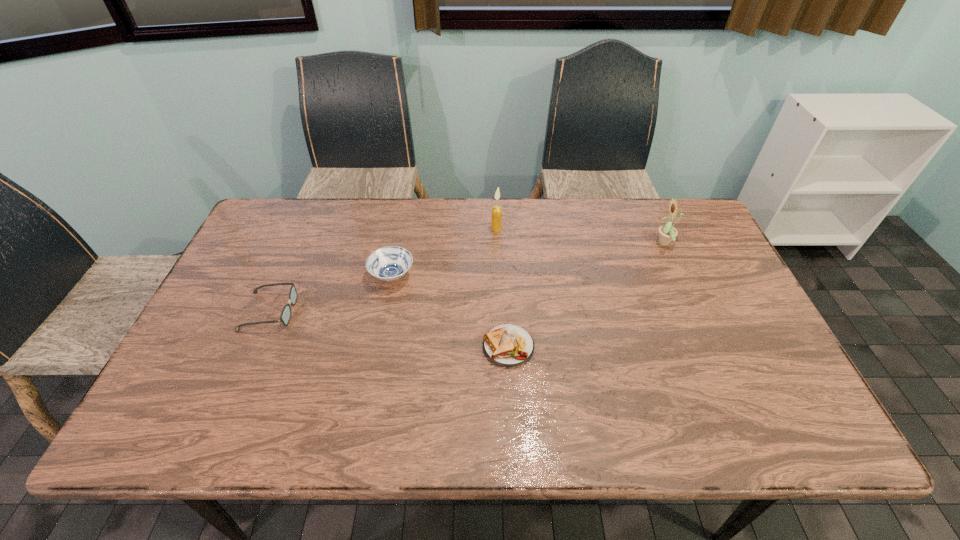
Locate an element on the screen. blank area located on the front-facing side of the fourth nearest object is located at coordinates (553, 244).

You are a GUI agent. You are given a task and a screenshot of the screen. Output one action in this format:
    pyautogui.click(x=<x>, y=<y>)
    Task: Click on the vacant space located on the front-facing side of the fourth nearest object
    The width and height of the screenshot is (960, 540).
    Given the screenshot: What is the action you would take?
    point(614,244)

At what (x,y) coordinates should I click in order to perform the action: click on free spot located on the left of the second object from left to right. Please return your answer as a coordinate pair (x, y). Looking at the image, I should click on (235, 276).

This screenshot has height=540, width=960. Identify the location of free space located 0.350m on the face of the second shortest object. (425, 311).

Where is `vacant space located 0.270m on the left of the shortest object`? Image resolution: width=960 pixels, height=540 pixels. vacant space located 0.270m on the left of the shortest object is located at coordinates (375, 346).

Find the location of a particular element. The image size is (960, 540). candle that is at the far edge is located at coordinates (496, 225).

The width and height of the screenshot is (960, 540). I want to click on sunflower located at the far edge, so click(x=667, y=233).

At what (x,y) coordinates should I click in order to perform the action: click on object positioned at the left edge. Please return your answer as a coordinate pair (x, y). This screenshot has width=960, height=540. Looking at the image, I should click on (285, 316).

Image resolution: width=960 pixels, height=540 pixels. Identify the location of object that is at the right edge. (667, 233).

Where is `object positioned at the far right corner`? object positioned at the far right corner is located at coordinates (667, 233).